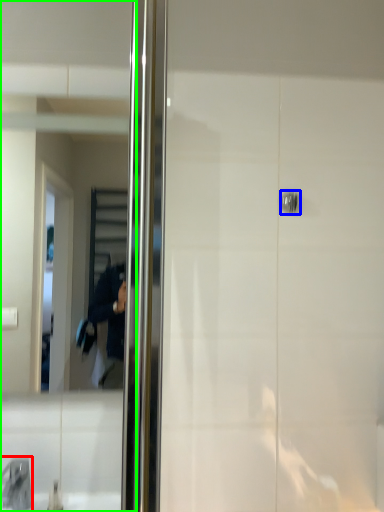
Question: Which object is positioned farthest from faucet (highlighted by a red box)? Select from door handle (highlighted by a blue box) and mirror (highlighted by a green box).

Choices:
 (A) door handle
 (B) mirror

Answer: (A)